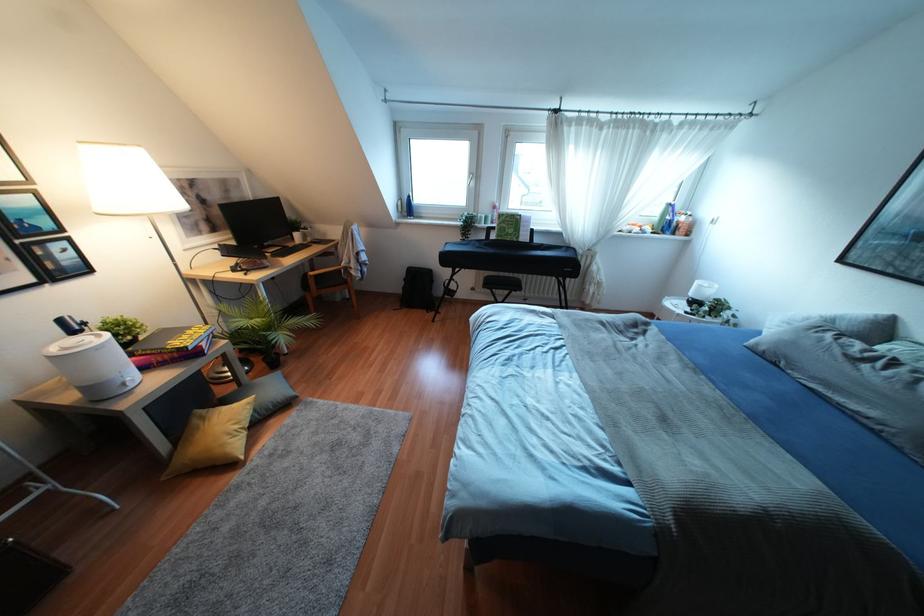
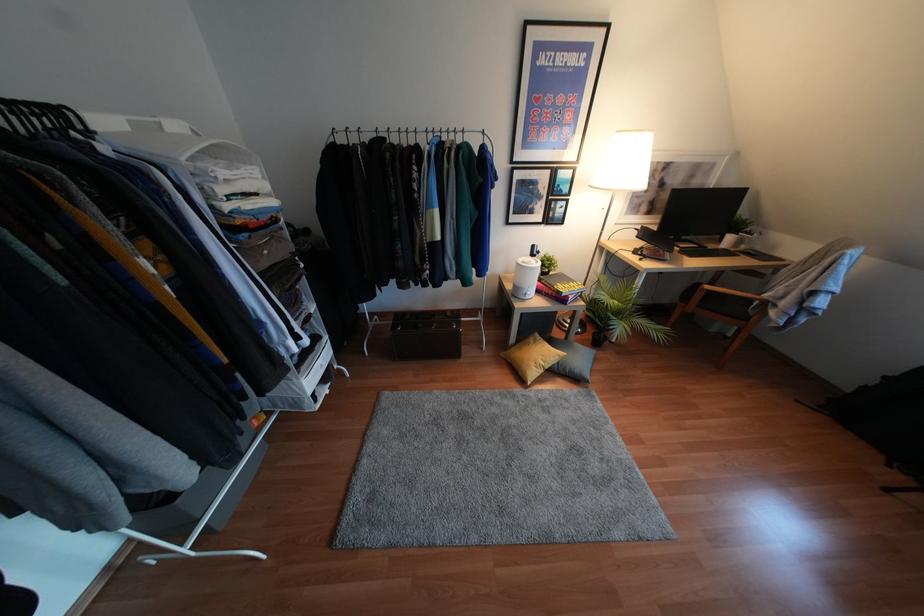
In the second image, find the point that corresponds to (345,282) in the first image.

(745, 318)